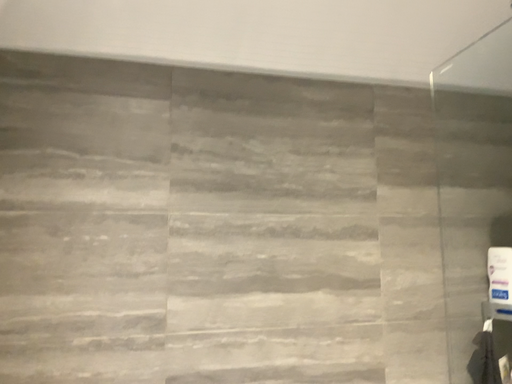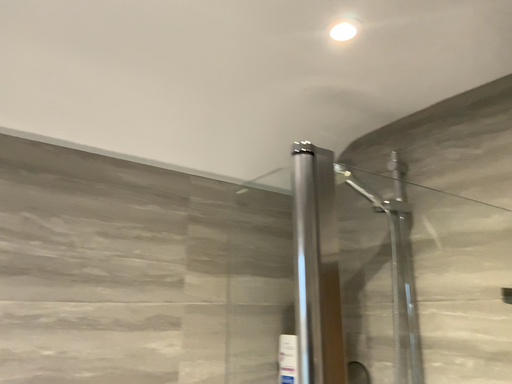
Question: How did the camera likely rotate when shooting the video?

Choices:
 (A) rotated upward
 (B) rotated downward

Answer: (A)